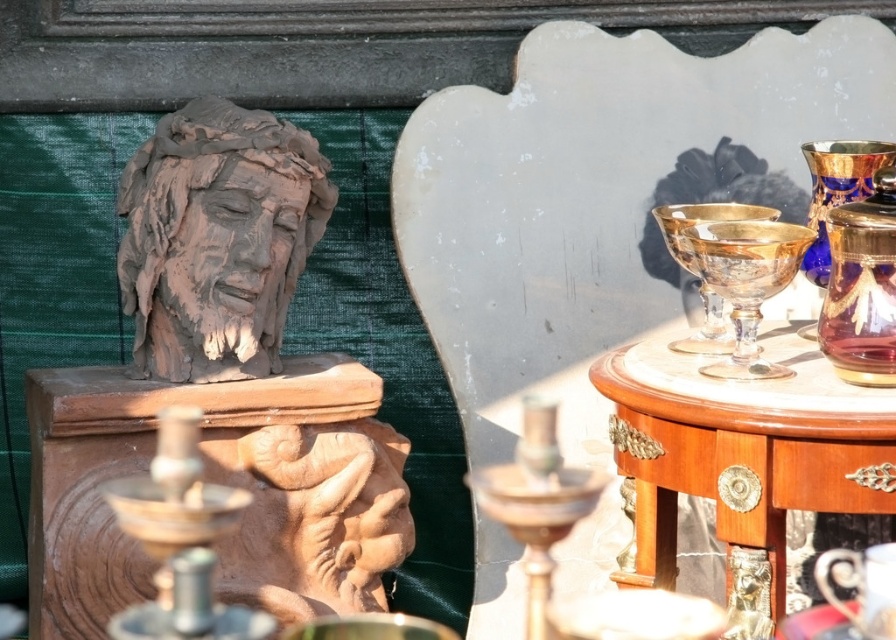
Question: Considering the real-world distances, which object is closest to the clay head at left?

Choices:
 (A) bronze metallic candle holder at lower left
 (B) terracotta statue at left
 (C) wooden polished table at right

Answer: (B)

Question: Can you confirm if wooden polished table at right is positioned below bronze metallic candle holder at lower left?

Choices:
 (A) no
 (B) yes

Answer: (A)

Question: Which point is closer to the camera taking this photo?

Choices:
 (A) (201, 561)
 (B) (808, 403)

Answer: (A)

Question: Considering the relative positions of terracotta statue at left and clay head at left in the image provided, where is terracotta statue at left located with respect to clay head at left?

Choices:
 (A) above
 (B) below

Answer: (B)

Question: Which is nearer to the terracotta statue at left?

Choices:
 (A) clay head at left
 (B) gold glass candle holder at right
 (C) wooden polished table at right
 (D) bronze metallic candle holder at lower left

Answer: (A)

Question: Can you confirm if terracotta statue at left is positioned to the right of gold glass candle holder at right?

Choices:
 (A) yes
 (B) no

Answer: (B)